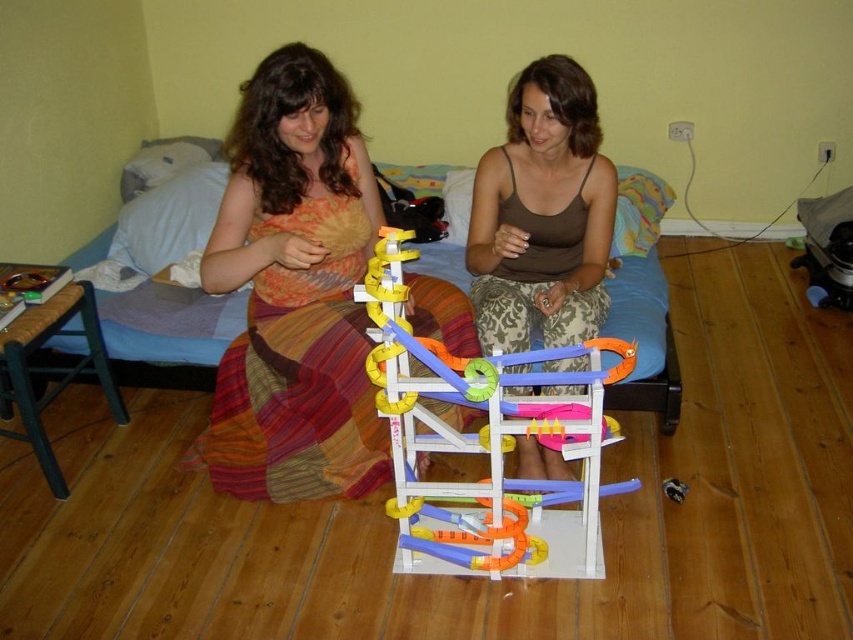
Question: Does multicolored fabric skirt at center appear on the right side of brown fabric tank top at center?

Choices:
 (A) yes
 (B) no

Answer: (B)

Question: Does blue fabric bed at center lie in front of brown woven stool at left?

Choices:
 (A) yes
 (B) no

Answer: (B)

Question: Among these objects, which one is farthest from the camera?

Choices:
 (A) blue fabric bed at center
 (B) brown fabric tank top at center
 (C) brown woven stool at left

Answer: (A)

Question: Which object is positioned closest to the multicolored plastic race track at center?

Choices:
 (A) brown woven stool at left
 (B) blue fabric bed at center

Answer: (B)

Question: Can you confirm if multicolored fabric skirt at center is positioned to the left of brown woven stool at left?

Choices:
 (A) no
 (B) yes

Answer: (A)

Question: Which object is closer to the camera taking this photo?

Choices:
 (A) multicolored plastic race track at center
 (B) multicolored fabric skirt at center

Answer: (A)